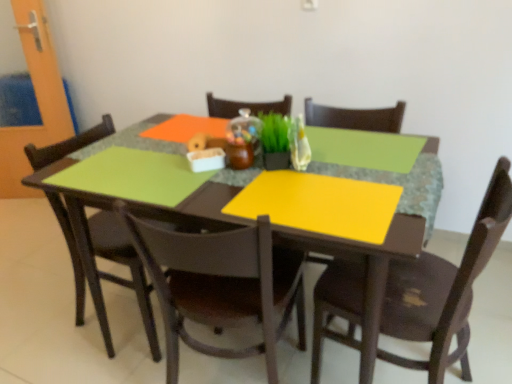
Question: Is matte brown chair at center, which ranks as the second chair in left-to-right order, oriented towards green matte plant at center?

Choices:
 (A) yes
 (B) no

Answer: (B)

Question: Does matte brown chair at center, which is counted as the 2th chair, starting from the right, have a greater height compared to green matte plant at center?

Choices:
 (A) no
 (B) yes

Answer: (B)

Question: Does matte brown chair at center, which ranks as the second chair in left-to-right order, have a lesser width compared to green matte plant at center?

Choices:
 (A) no
 (B) yes

Answer: (A)

Question: Is matte brown chair at center, which is counted as the 2th chair, starting from the right, closer to camera compared to green matte plant at center?

Choices:
 (A) yes
 (B) no

Answer: (A)

Question: Is matte brown chair at center, which is counted as the 2th chair, starting from the right, positioned far away from green matte plant at center?

Choices:
 (A) yes
 (B) no

Answer: (B)

Question: Considering the positions of green matte plant at center and orange matte glass door at left in the image, is green matte plant at center wider or thinner than orange matte glass door at left?

Choices:
 (A) wide
 (B) thin

Answer: (A)

Question: Is green matte plant at center inside or outside of orange matte glass door at left?

Choices:
 (A) inside
 (B) outside

Answer: (B)

Question: Is point (267, 150) closer or farther from the camera than point (20, 188)?

Choices:
 (A) closer
 (B) farther

Answer: (A)

Question: In the image, is green matte plant at center on the left side or the right side of orange matte glass door at left?

Choices:
 (A) left
 (B) right

Answer: (B)

Question: Is point (394, 117) positioned closer to the camera than point (329, 268)?

Choices:
 (A) farther
 (B) closer

Answer: (A)

Question: In terms of height, does yellow matte placemat at center look taller or shorter compared to wooden chair at lower right, acting as the third chair starting from the left?

Choices:
 (A) short
 (B) tall

Answer: (A)

Question: Do you think yellow matte placemat at center is within wooden chair at lower right, acting as the first chair starting from the right, or outside of it?

Choices:
 (A) outside
 (B) inside

Answer: (A)

Question: In the image, is yellow matte placemat at center on the left side or the right side of wooden chair at lower right, acting as the first chair starting from the right?

Choices:
 (A) right
 (B) left

Answer: (B)

Question: From the image's perspective, is matte brown chair at left, the 1th chair positioned from the left, above or below matte wooden table at center?

Choices:
 (A) below
 (B) above

Answer: (B)

Question: Would you say matte brown chair at left, which ranks as the third chair in right-to-left order, is inside or outside matte wooden table at center?

Choices:
 (A) inside
 (B) outside

Answer: (A)